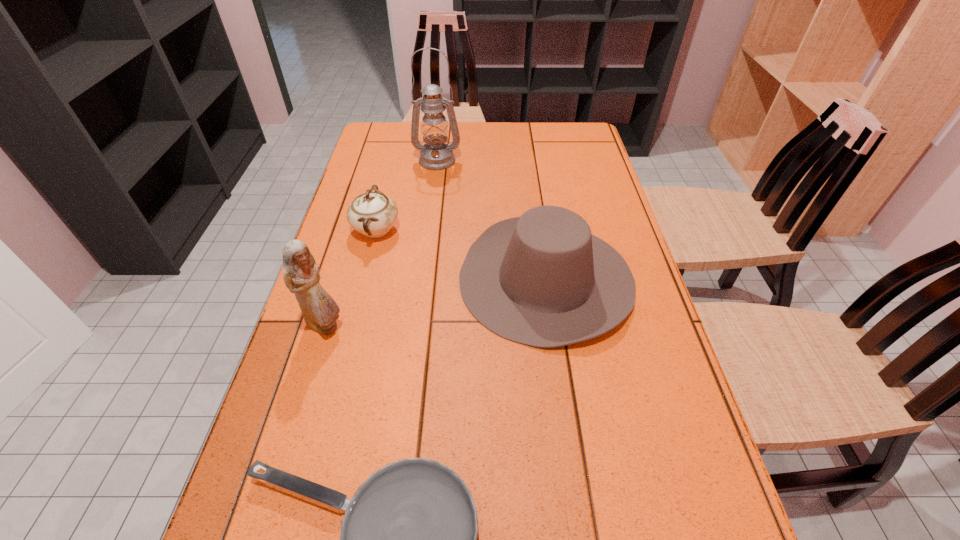
Locate an element on the screen. Image resolution: width=960 pixels, height=540 pixels. the tallest object is located at coordinates (435, 155).

Find the location of a particular element. oil lamp is located at coordinates (435, 155).

This screenshot has height=540, width=960. Identify the location of figurine. (301, 276).

Identify the location of the third shortest object. This screenshot has width=960, height=540. (542, 279).

In order to click on chinaware in this screenshot , I will do `click(373, 214)`.

I want to click on vacant space located 0.190m on the right of the farthest object, so click(x=517, y=160).

What are the coordinates of `free space located on the front-facing side of the figurine` in the screenshot? It's located at (513, 326).

Where is `vacant space located on the back of the cowboy hat`? vacant space located on the back of the cowboy hat is located at coordinates (537, 212).

I want to click on vacant space located 0.300m on the right of the chinaware, so click(x=508, y=230).

The image size is (960, 540). In order to click on object present at the far edge in this screenshot , I will do `click(435, 155)`.